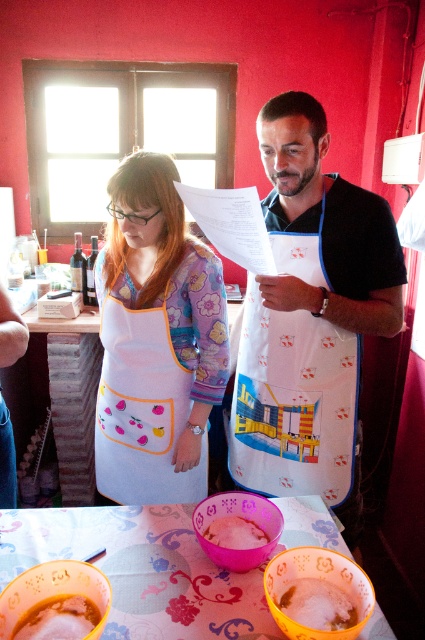
Question: Estimate the real-world distances between objects in this image. Which object is closer to the white sugar at lower center?

Choices:
 (A) white apron with colorful design at center
 (B) white fabric apron with colorful design at center
 (C) floral-patterned fabric at lower center
 (D) white frothy liquid at lower left

Answer: (C)

Question: Is white apron with colorful designs at center positioned at the back of floral-patterned fabric at lower center?

Choices:
 (A) no
 (B) yes

Answer: (B)

Question: Can you confirm if white apron with colorful design at center is positioned above pink matte plastic bowl at center?

Choices:
 (A) yes
 (B) no

Answer: (A)

Question: Where is white frothy liquid at lower left located in relation to pink matte plastic bowl at center in the image?

Choices:
 (A) above
 (B) below

Answer: (B)

Question: Among these points, which one is farthest from the camera?

Choices:
 (A) (303, 596)
 (B) (379, 253)
 (C) (195, 628)

Answer: (B)

Question: Which point is farther to the camera?

Choices:
 (A) (124, 182)
 (B) (20, 625)

Answer: (A)